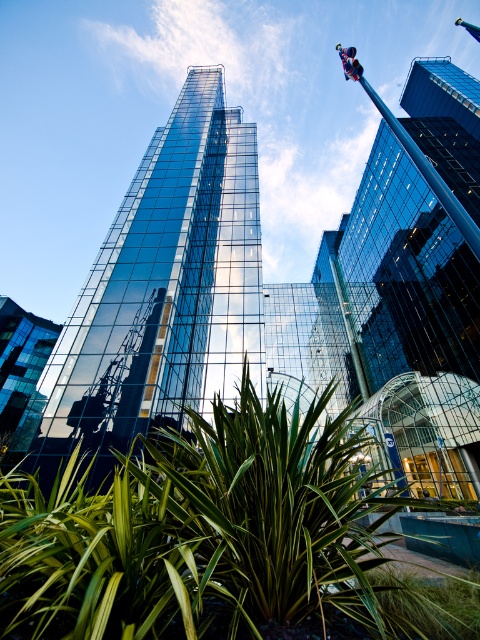
Who is lower down, glossy glass tower at center or shiny glass building at lower left?

shiny glass building at lower left is lower down.

Is glossy glass tower at center wider than shiny glass building at lower left?

In fact, glossy glass tower at center might be narrower than shiny glass building at lower left.

Which is behind, point (59, 449) or point (35, 369)?

The point (35, 369) is behind.

Locate an element on the screen. glossy glass tower at center is located at coordinates (164, 289).

Is point (111, 241) closer to camera compared to point (414, 259)?

Yes, point (111, 241) is closer to viewer.

The width and height of the screenshot is (480, 640). What are the coordinates of `glossy glass tower at center` in the screenshot? It's located at (164, 289).

The image size is (480, 640). What are the coordinates of `glossy glass tower at center` in the screenshot? It's located at (164, 289).

Is green leafy plant at center positioned in front of shiny glass building at lower left?

Yes, green leafy plant at center is in front of shiny glass building at lower left.

Which is more to the right, green leafy plant at center or shiny glass building at lower left?

green leafy plant at center

What do you see at coordinates (205, 536) in the screenshot?
I see `green leafy plant at center` at bounding box center [205, 536].

Where is `green leafy plant at center`? The width and height of the screenshot is (480, 640). green leafy plant at center is located at coordinates (205, 536).